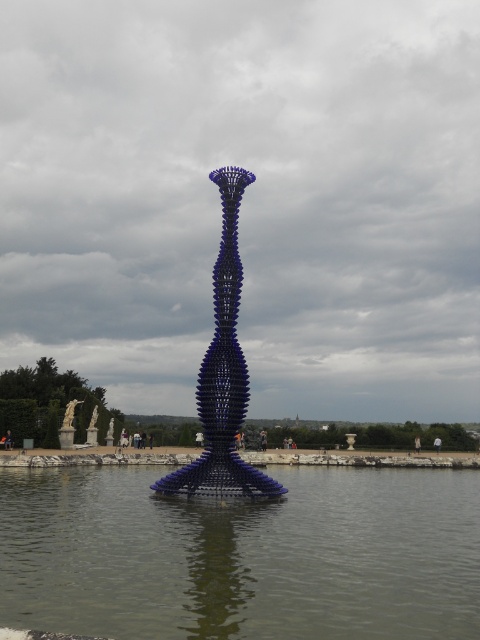
Question: Considering the real-world distances, which object is farthest from the transparent water at center?

Choices:
 (A) blue glossy vase at center
 (B) white marble statue at left

Answer: (B)

Question: Is transparent water at center bigger than blue glossy vase at center?

Choices:
 (A) yes
 (B) no

Answer: (A)

Question: Which of the following is the closest to the observer?

Choices:
 (A) (64, 438)
 (B) (391, 563)
 (C) (226, 172)

Answer: (B)

Question: Which of these objects is positioned farthest from the blue glossy vase at center?

Choices:
 (A) white marble statue at left
 (B) transparent water at center

Answer: (A)

Question: Does blue glossy vase at center appear under white marble statue at left?

Choices:
 (A) yes
 (B) no

Answer: (B)

Question: In this image, where is transparent water at center located relative to blue glossy vase at center?

Choices:
 (A) above
 (B) below

Answer: (B)